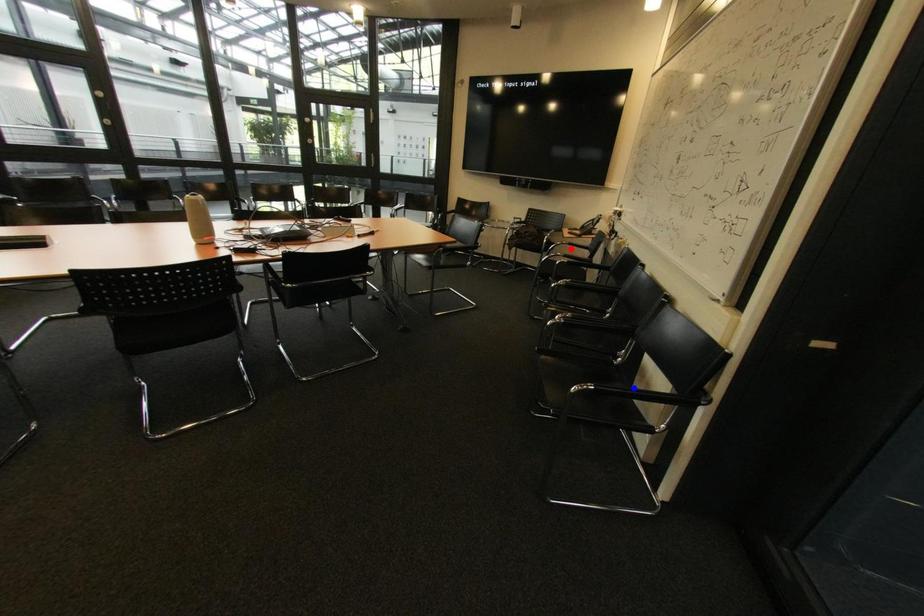
Question: Which of the two points in the image is closer to the camera?

Choices:
 (A) Blue point is closer.
 (B) Red point is closer.

Answer: (A)